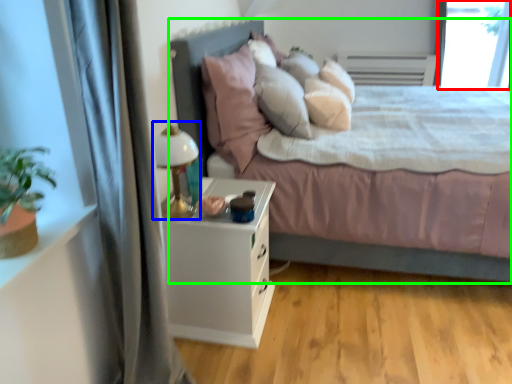
Question: Which object is the farthest from window screen (highlighted by a red box)? Choose among these: table lamp (highlighted by a blue box) or bed (highlighted by a green box).

Choices:
 (A) table lamp
 (B) bed

Answer: (A)